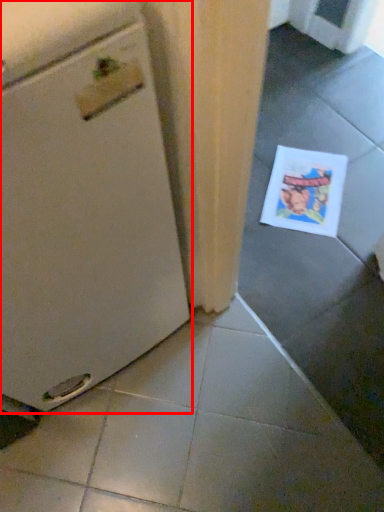
Question: From the image's perspective, where is home appliance (annotated by the red box) located relative to comic book?

Choices:
 (A) above
 (B) below

Answer: (B)